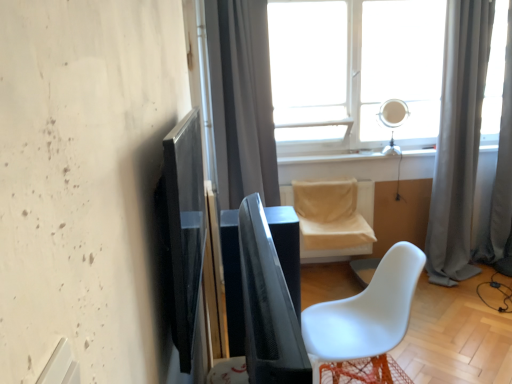
Question: From a real-world perspective, is gray fabric curtain at right, which appears as the second curtain when viewed from the left, over gray fabric curtain at upper center, arranged as the first curtain when viewed from the left?

Choices:
 (A) no
 (B) yes

Answer: (A)

Question: Is gray fabric curtain at right, which appears as the second curtain when viewed from the left, taller than gray fabric curtain at upper center, arranged as the first curtain when viewed from the left?

Choices:
 (A) no
 (B) yes

Answer: (B)

Question: Considering the relative positions of gray fabric curtain at right, which is the 2th curtain from right to left, and gray fabric curtain at upper center, which ranks as the 3th curtain in right-to-left order, in the image provided, is gray fabric curtain at right, which is the 2th curtain from right to left, to the right of gray fabric curtain at upper center, which ranks as the 3th curtain in right-to-left order, from the viewer's perspective?

Choices:
 (A) no
 (B) yes

Answer: (B)

Question: From a real-world perspective, is gray fabric curtain at right, which appears as the second curtain when viewed from the left, under gray fabric curtain at upper center, which ranks as the 3th curtain in right-to-left order?

Choices:
 (A) no
 (B) yes

Answer: (B)

Question: Is gray fabric curtain at upper center, arranged as the first curtain when viewed from the left, located within gray fabric curtain at right, which appears as the second curtain when viewed from the left?

Choices:
 (A) no
 (B) yes

Answer: (A)

Question: In the image, is black glossy screen door at left on the left side or the right side of transparent glass window at upper center?

Choices:
 (A) right
 (B) left

Answer: (B)

Question: Is black glossy screen door at left inside or outside of transparent glass window at upper center?

Choices:
 (A) inside
 (B) outside

Answer: (B)

Question: Is point (181, 153) positioned closer to the camera than point (294, 44)?

Choices:
 (A) closer
 (B) farther

Answer: (A)

Question: Considering the positions of black glossy screen door at left and transparent glass window at upper center in the image, is black glossy screen door at left wider or thinner than transparent glass window at upper center?

Choices:
 (A) wide
 (B) thin

Answer: (B)

Question: Visually, is gray fabric curtain at right, the first curtain viewed from the right, positioned to the left or to the right of gray fabric curtain at right, which appears as the second curtain when viewed from the left?

Choices:
 (A) left
 (B) right

Answer: (B)

Question: In terms of height, does gray fabric curtain at right, the third curtain from the left, look taller or shorter compared to gray fabric curtain at right, which is the 2th curtain from right to left?

Choices:
 (A) short
 (B) tall

Answer: (A)

Question: In the image, is gray fabric curtain at right, the third curtain from the left, positioned in front of or behind gray fabric curtain at right, which appears as the second curtain when viewed from the left?

Choices:
 (A) behind
 (B) front

Answer: (A)

Question: Do you think gray fabric curtain at right, the first curtain viewed from the right, is within gray fabric curtain at right, which appears as the second curtain when viewed from the left, or outside of it?

Choices:
 (A) outside
 (B) inside

Answer: (A)

Question: From a real-world perspective, is transparent glass window at upper center positioned above or below white matte chair at lower right, which ranks as the first chair in front-to-back order?

Choices:
 (A) below
 (B) above

Answer: (B)

Question: Is transparent glass window at upper center inside or outside of white matte chair at lower right, the second chair positioned from the back?

Choices:
 (A) outside
 (B) inside

Answer: (A)